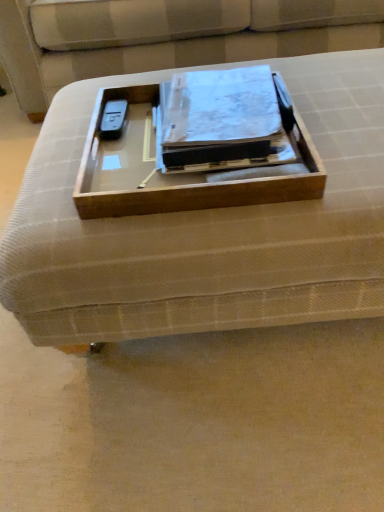
In the scene shown: Measure the distance between point [92,12] and camera.

The depth of point [92,12] is 1.43 meters.

What is the approximate width of matte plastic binder at center?

The width of matte plastic binder at center is 31.23 centimeters.

Describe the element at coordinates (205, 229) in the screenshot. The width and height of the screenshot is (384, 512). I see `wooden tray at center` at that location.

You are a GUI agent. You are given a task and a screenshot of the screen. Output one action in this format:
    pyautogui.click(x=<x>, y=<y>)
    Task: Click on the beige fabric couch at center
    
    Given the screenshot: What is the action you would take?
    pyautogui.click(x=167, y=37)

Is wooden tray at center placed right next to beige fabric couch at center?

They are not placed beside each other.

Is wooden tray at center situated inside beige fabric couch at center or outside?

wooden tray at center exists outside the volume of beige fabric couch at center.

From a real-world perspective, between wooden tray at center and beige fabric couch at center, who is vertically higher?

From a 3D spatial view, wooden tray at center is above.

Considering the relative sizes of wooden tray at center and beige fabric couch at center in the image provided, is wooden tray at center bigger than beige fabric couch at center?

Incorrect, wooden tray at center is not larger than beige fabric couch at center.

Is the position of wooden tray at center less distant than that of matte plastic binder at center?

Yes, wooden tray at center is in front of matte plastic binder at center.

Consider the image. Is wooden tray at center facing away from matte plastic binder at center?

wooden tray at center is not turned away from matte plastic binder at center.

From the image's perspective, which one is positioned lower, wooden tray at center or matte plastic binder at center?

wooden tray at center.

Is beige fabric couch at center completely or partially outside of wooden tray at center?

Absolutely, beige fabric couch at center is external to wooden tray at center.

From a real-world perspective, who is located lower, beige fabric couch at center or wooden tray at center?

In real-world perspective, wooden tray at center is lower.

Which of these two, beige fabric couch at center or wooden tray at center, is smaller?

wooden tray at center.

How distant is beige fabric couch at center from wooden tray at center?

31.97 inches.

Considering the positions of points (200, 23) and (245, 169), is point (200, 23) closer to camera compared to point (245, 169)?

No.

In terms of width, does beige fabric couch at center look wider or thinner when compared to wooden tray at center?

beige fabric couch at center is wider than wooden tray at center.

From the image's perspective, which one is positioned lower, beige fabric couch at center or wooden tray at center?

wooden tray at center is shown below in the image.

From a real-world perspective, is wooden tray at center positioned over beige fabric couch at center based on gravity?

No, from a real-world perspective, wooden tray at center is not on top of beige fabric couch at center.

Is wooden tray at center positioned with its back to beige fabric couch at center?

Yes, wooden tray at center is positioned with its back facing beige fabric couch at center.

Considering the sizes of wooden tray at center and beige fabric couch at center in the image, is wooden tray at center taller or shorter than beige fabric couch at center?

Considering their sizes, wooden tray at center has less height than beige fabric couch at center.

From the image's perspective, which is above, wooden tray at center or beige fabric couch at center?

beige fabric couch at center appears higher in the image.

Consider the image. Is matte plastic binder at center wider than wooden tray at center?

In fact, matte plastic binder at center might be narrower than wooden tray at center.

From a real-world perspective, which is physically above, matte plastic binder at center or wooden tray at center?

matte plastic binder at center.

Which object is positioned more to the right, matte plastic binder at center or wooden tray at center?

wooden tray at center is more to the right.

Considering the relative positions of wooden tray at center and wooden tray at center in the image provided, is wooden tray at center to the left or to the right of wooden tray at center?

Based on their positions, wooden tray at center is located to the right of wooden tray at center.

Considering the relative positions of wooden tray at center and wooden tray at center in the image provided, is wooden tray at center behind wooden tray at center?

No, the depth of wooden tray at center is less than that of wooden tray at center.

Is wooden tray at center taller than wooden tray at center?

Yes.

From the image's perspective, who appears lower, wooden tray at center or wooden tray at center?

wooden tray at center appears lower in the image.

Find the location of a particular element. box located in front of the beige fabric couch at center is located at coordinates click(183, 170).

Locate an element on the screen. The height and width of the screenshot is (512, 384). furniture lying on the right of matte plastic binder at center is located at coordinates (205, 229).

In the scene shown: Estimate the real-world distances between objects in this image. Which object is further from matte plastic binder at center, wooden tray at center or wooden tray at center?

wooden tray at center is positioned further to the anchor matte plastic binder at center.

When comparing their distances from beige fabric couch at center, does matte plastic binder at center or wooden tray at center seem further?

wooden tray at center.

Consider the image. Looking at the image, which one is located closer to wooden tray at center, beige fabric couch at center or wooden tray at center?

The object closer to wooden tray at center is wooden tray at center.

Which object lies nearer to the anchor point beige fabric couch at center, matte plastic binder at center or wooden tray at center?

matte plastic binder at center is closer to beige fabric couch at center.

From the image, which object appears to be farther from wooden tray at center, matte plastic binder at center or beige fabric couch at center?

beige fabric couch at center.

Based on their spatial positions, is beige fabric couch at center or wooden tray at center further from wooden tray at center?

beige fabric couch at center is positioned further to the anchor wooden tray at center.

Looking at the image, which one is located closer to wooden tray at center, wooden tray at center or matte plastic binder at center?

matte plastic binder at center lies closer to wooden tray at center than the other object.

Which object lies further to the anchor point wooden tray at center, wooden tray at center or beige fabric couch at center?

beige fabric couch at center is further to wooden tray at center.

The image size is (384, 512). Find the location of `binder between beige fabric couch at center and wooden tray at center from top to bottom`. binder between beige fabric couch at center and wooden tray at center from top to bottom is located at coordinates (220, 121).

You are a GUI agent. You are given a task and a screenshot of the screen. Output one action in this format:
    pyautogui.click(x=<x>, y=<y>)
    Task: Click on the box that lies between beige fabric couch at center and wooden tray at center from top to bottom
    The image size is (384, 512).
    Given the screenshot: What is the action you would take?
    pyautogui.click(x=183, y=170)

Find the location of `binder between wooden tray at center and wooden tray at center from left to right`. binder between wooden tray at center and wooden tray at center from left to right is located at coordinates (220, 121).

Locate an element on the screen. binder that lies between beige fabric couch at center and wooden tray at center from top to bottom is located at coordinates (220, 121).